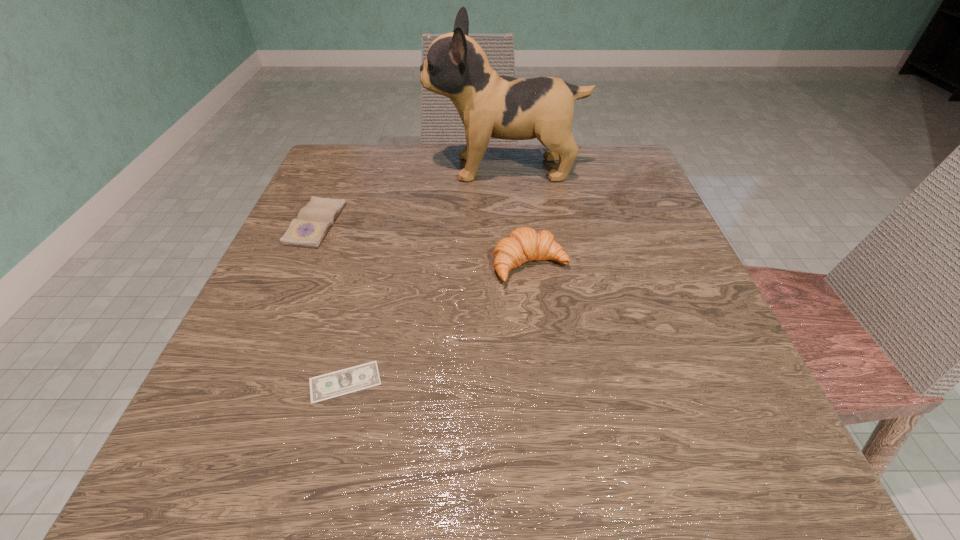
I want to click on free space that satisfies the following two spatial constraints: 1. on the back side of the crescent roll; 2. at the face of the tallest object, so point(518,168).

At what (x,y) coordinates should I click in order to perform the action: click on free space that satisfies the following two spatial constraints: 1. at the face of the puppy; 2. on the left side of the third shortest object. Please return your answer as a coordinate pair (x, y). This screenshot has height=540, width=960. Looking at the image, I should click on (512, 265).